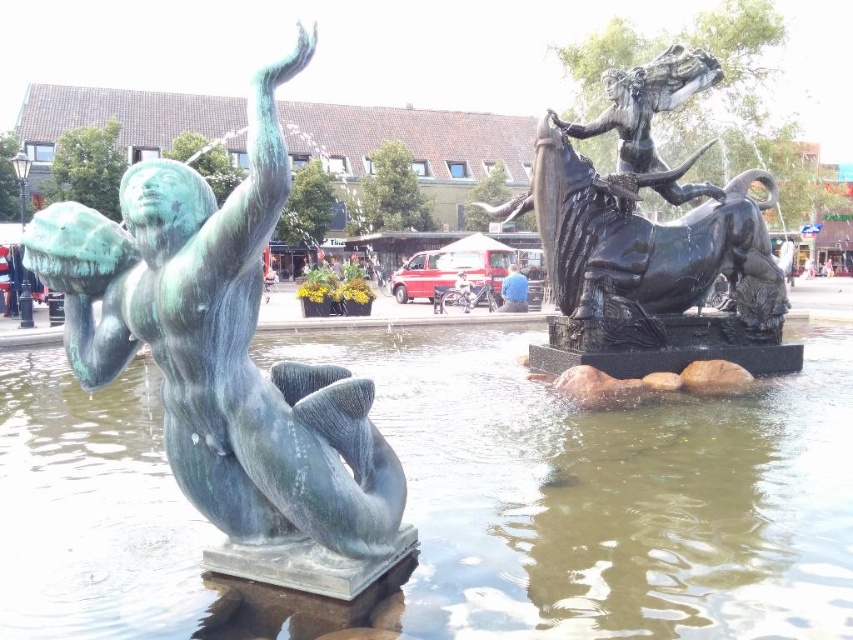
Question: Which point is closer to the camera?

Choices:
 (A) (67, 496)
 (B) (788, 240)

Answer: (A)

Question: Which point is farther to the camera?

Choices:
 (A) green patina water at center
 (B) white fluffy cloud at upper center

Answer: (B)

Question: Which object appears closest to the camera in this image?

Choices:
 (A) polished bronze statue at center
 (B) light blue fabric bicycle at center
 (C) green patina water at center

Answer: (C)

Question: Can you confirm if green patina water at center is positioned below white fluffy cloud at upper center?

Choices:
 (A) no
 (B) yes

Answer: (B)

Question: Is green patina water at center smaller than light blue fabric bicycle at center?

Choices:
 (A) yes
 (B) no

Answer: (B)

Question: Can you confirm if green patina water at center is positioned below light blue fabric bicycle at center?

Choices:
 (A) no
 (B) yes

Answer: (B)